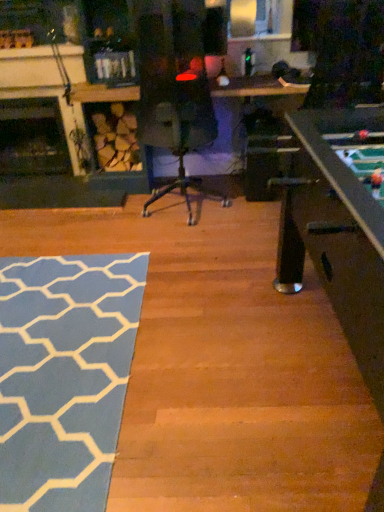
The height and width of the screenshot is (512, 384). What are the coordinates of `vacant region in front of dark wood fireplace at left, the first fireplace when ordered from front to back` in the screenshot? It's located at (47, 217).